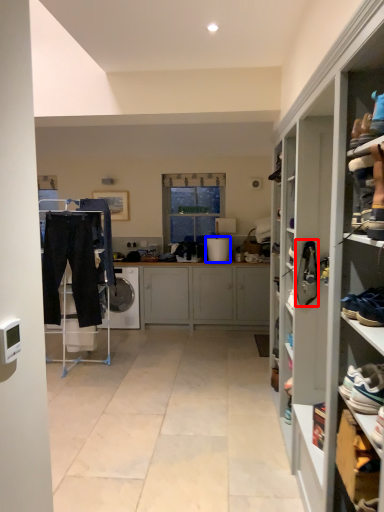
Question: Which of the following is the closest to the observer, shoe (highlighted by a red box) or appliance (highlighted by a blue box)?

Choices:
 (A) shoe
 (B) appliance

Answer: (A)